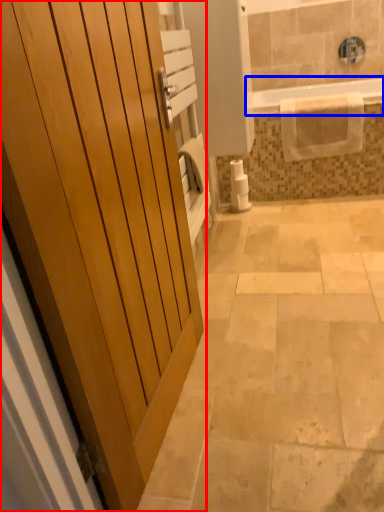
Question: Which of the following is the farthest to the observer, door (highlighted by a red box) or bathtub (highlighted by a blue box)?

Choices:
 (A) door
 (B) bathtub

Answer: (B)